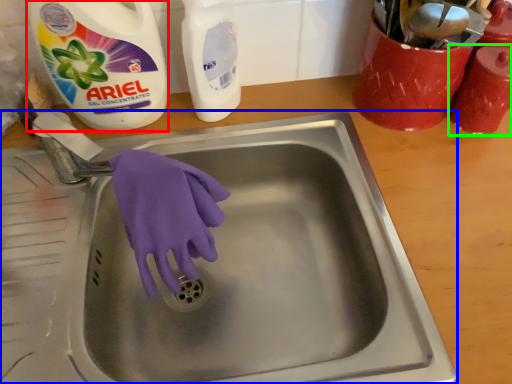
Question: Which object is the closest to the cleaning product (highlighted by a red box)? Choose among these: sink (highlighted by a blue box) or cleaning product (highlighted by a green box).

Choices:
 (A) sink
 (B) cleaning product

Answer: (A)